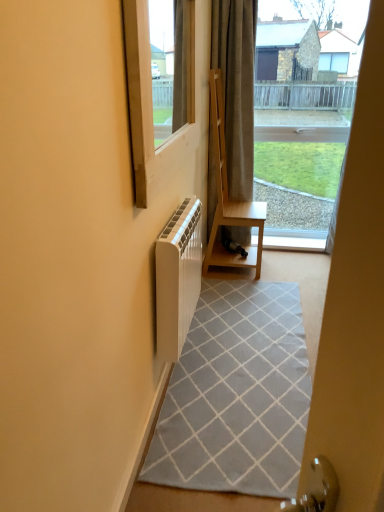
Question: From the image's perspective, is light brown wood shelf at center on dark gray textured curtain at center?

Choices:
 (A) no
 (B) yes

Answer: (A)

Question: Is light brown wood shelf at center oriented away from dark gray textured curtain at center?

Choices:
 (A) no
 (B) yes

Answer: (A)

Question: From a real-world perspective, is light brown wood shelf at center on dark gray textured curtain at center?

Choices:
 (A) no
 (B) yes

Answer: (A)

Question: Is light brown wood shelf at center completely or partially outside of dark gray textured curtain at center?

Choices:
 (A) yes
 (B) no

Answer: (A)

Question: From a real-world perspective, is light brown wood shelf at center located beneath dark gray textured curtain at center?

Choices:
 (A) no
 (B) yes

Answer: (B)

Question: Looking at their shapes, would you say light brown wood shelf at center is wider or thinner than white plastic window at upper left?

Choices:
 (A) thin
 (B) wide

Answer: (B)

Question: In the image, is light brown wood shelf at center on the left side or the right side of white plastic window at upper left?

Choices:
 (A) left
 (B) right

Answer: (B)

Question: Does point (254, 223) appear closer or farther from the camera than point (157, 159)?

Choices:
 (A) farther
 (B) closer

Answer: (A)

Question: From the image's perspective, is light brown wood shelf at center located above or below white plastic window at upper left?

Choices:
 (A) above
 (B) below

Answer: (B)

Question: Does point (220, 178) appear closer or farther from the camera than point (307, 246)?

Choices:
 (A) farther
 (B) closer

Answer: (B)

Question: Is light brown wood shelf at center spatially inside white wood at center, or outside of it?

Choices:
 (A) inside
 (B) outside

Answer: (B)

Question: Would you say light brown wood shelf at center is to the left or to the right of white wood at center in the picture?

Choices:
 (A) left
 (B) right

Answer: (A)

Question: In terms of width, does light brown wood shelf at center look wider or thinner when compared to white wood at center?

Choices:
 (A) thin
 (B) wide

Answer: (B)

Question: Based on their sizes in the image, would you say white wood at center is bigger or smaller than white plastic window at upper left?

Choices:
 (A) big
 (B) small

Answer: (B)

Question: Relative to white plastic window at upper left, is white wood at center in front or behind?

Choices:
 (A) behind
 (B) front

Answer: (A)